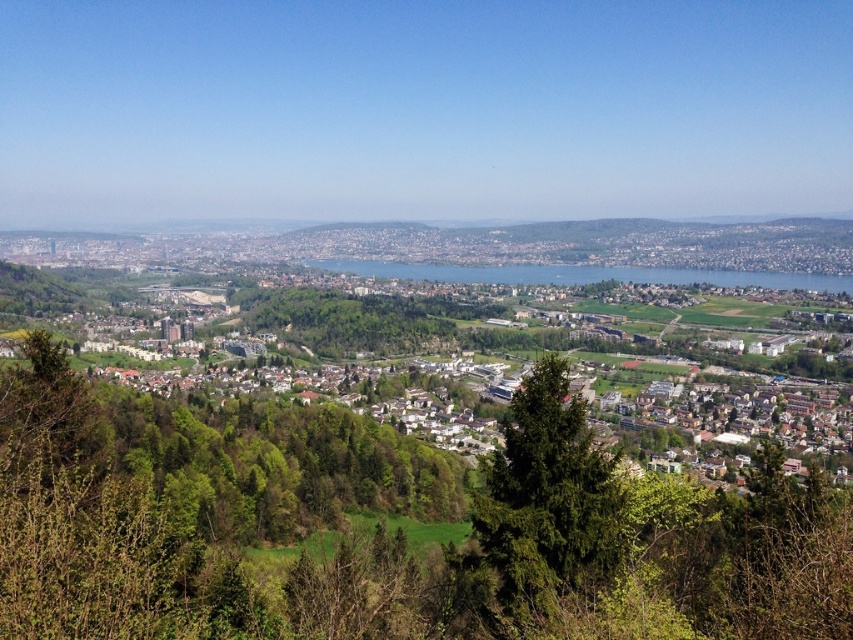
You are a city planner analyzing the urban layout. You notice the green grassy town at center and the green leafy tree at center. Which of these two features occupies more space in the central area of the image?

The green grassy town at center is bigger than the green leafy tree at center, so it occupies more space in the central area.

You are a drone operator flying over the urban landscape described. Your task is to deliver a package to the green grassy town at center. However, there is a green leafy tree at center in your flight path. Based on the scene, can you safely fly over the tree to reach the town without any obstruction?

The green grassy town at center is located above the green leafy tree at center, so yes, the drone can safely fly over the tree to reach the town since the town is positioned higher than the tree.